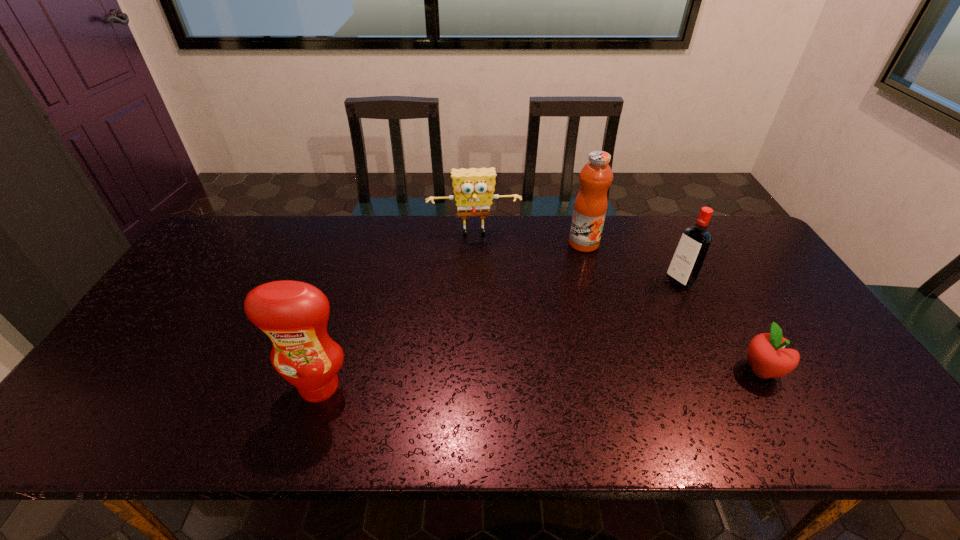
Find the location of a particular element. vacant space on the desktop that is between the leftmost object and the shortest object and is positioned on the front and back of the third nearest object is located at coordinates (509, 380).

Where is `vacant space on the desktop that is between the leftmost object and the shortest object and is positioned on the front label of the third object from left to right`? The height and width of the screenshot is (540, 960). vacant space on the desktop that is between the leftmost object and the shortest object and is positioned on the front label of the third object from left to right is located at coordinates (588, 376).

The height and width of the screenshot is (540, 960). I want to click on vacant space on the desktop that is between the leftmost object and the shortest object and is positioned on the face of the fourth object from right to left, so [x=487, y=380].